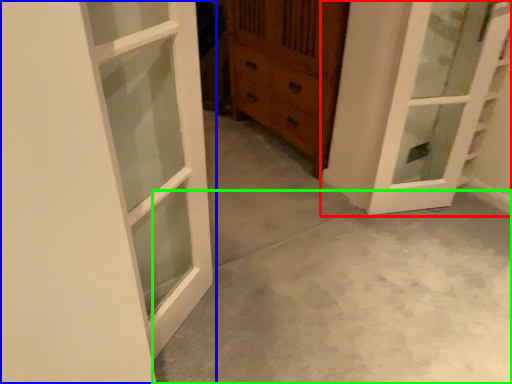
Question: Which object is the closest to the door (highlighted by a red box)? Choose among these: door (highlighted by a blue box) or concrete (highlighted by a green box).

Choices:
 (A) door
 (B) concrete

Answer: (B)